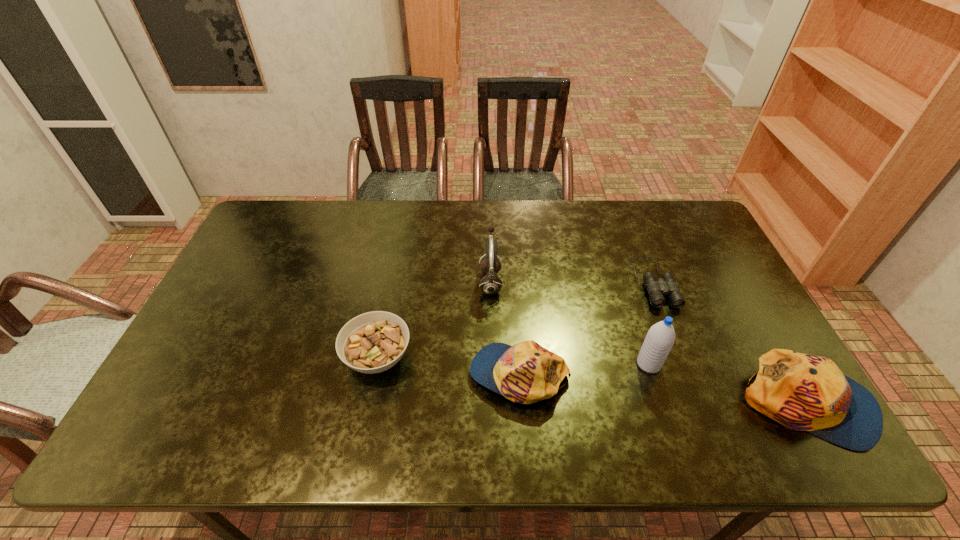
At what (x,y) coordinates should I click in order to perform the action: click on free space located 0.400m on the bill of the left cap. Please return your answer as a coordinate pair (x, y). Looking at the image, I should click on click(313, 374).

Where is `free location located on the bill of the left cap`? The height and width of the screenshot is (540, 960). free location located on the bill of the left cap is located at coordinates (411, 374).

The height and width of the screenshot is (540, 960). Identify the location of free space located 0.280m on the bill of the left cap. (360, 374).

The width and height of the screenshot is (960, 540). In order to click on free space located at the eyepiece of the shortest object in this screenshot , I will do (x=684, y=362).

Where is `free location located on the ear pads of the earphone`? free location located on the ear pads of the earphone is located at coordinates (444, 282).

I want to click on vacant space located 0.130m on the ear pads of the earphone, so click(437, 282).

Where is `vacant space located 0.060m on the ear pads of the earphone`? The height and width of the screenshot is (540, 960). vacant space located 0.060m on the ear pads of the earphone is located at coordinates (460, 282).

The image size is (960, 540). Find the location of `vacant space situated 0.160m on the back of the second shortest object`. vacant space situated 0.160m on the back of the second shortest object is located at coordinates (392, 288).

Locate an element on the screen. This screenshot has width=960, height=540. free spot located on the left of the water bottle is located at coordinates (513, 364).

This screenshot has height=540, width=960. I want to click on stew situated at the near edge, so click(373, 342).